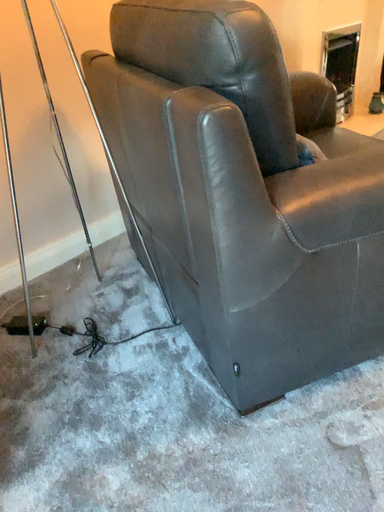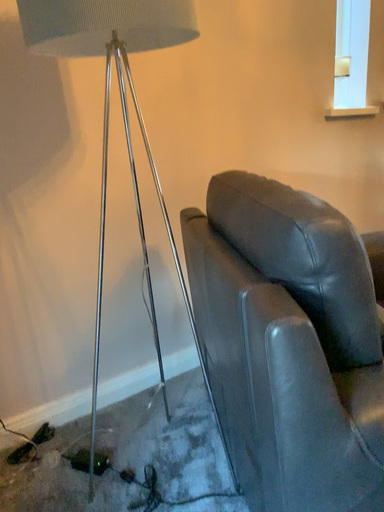
Question: Which way did the camera rotate in the video?

Choices:
 (A) rotated downward
 (B) rotated upward

Answer: (B)